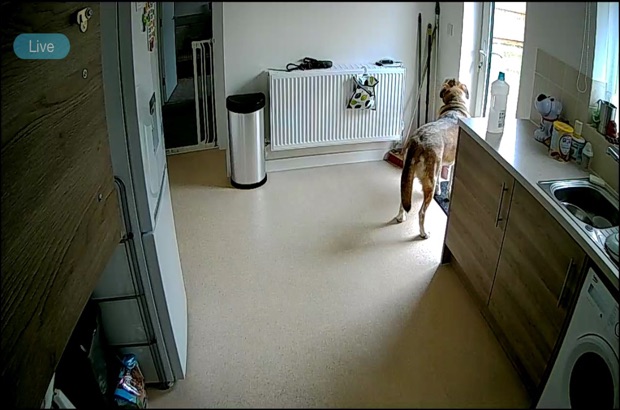
Where is `counter top`? The width and height of the screenshot is (620, 410). counter top is located at coordinates tap(521, 161).